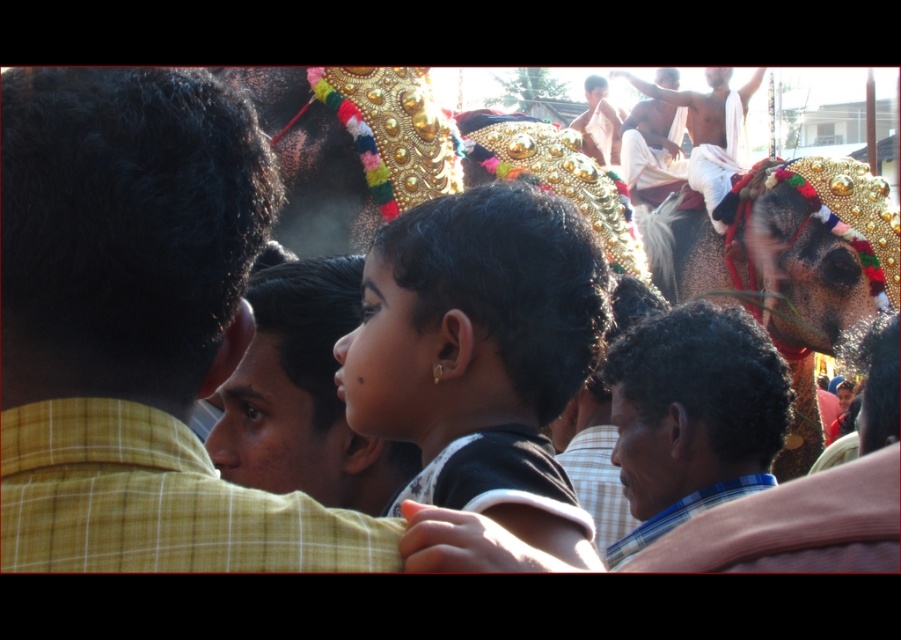
You are a photographer trying to capture the crowd observing the elephant. You notice two features in the foreground people, the black matte hair at center and the light brown skin at upper center. Which of these two features is located to the left of the other?

The black matte hair at center is positioned on the left side of light brown skin at upper center.

You are a photographer at this event and want to capture both the black matte hair at center and the dark skin man at upper right in a single frame. Based on their sizes, which one would appear closer to the camera?

The black matte hair at center appears larger in size than the dark skin man at upper right, so it would be closer to the camera.

You are a photographer at the event and want to capture a closeup shot of the black matte hair at center and the light brown skin at upper center. Which object should you focus on first if you want to ensure both are in focus?

The black matte hair at center is positioned under light brown skin at upper center, so you should focus on the light brown skin at upper center first since it is closer to the camera.